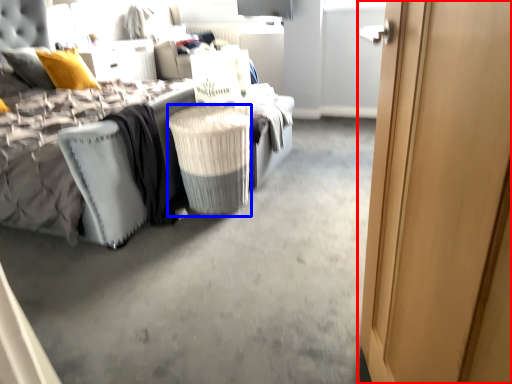
Question: Which point is further to the camera, door (highlighted by a red box) or laundry basket (highlighted by a blue box)?

Choices:
 (A) door
 (B) laundry basket

Answer: (B)